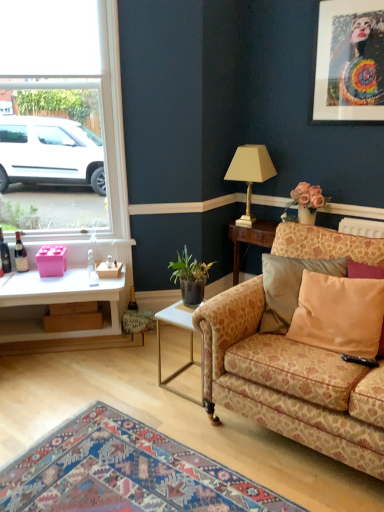
I want to click on free space underneath white metal side table at lower center (from a real-world perspective), so [x=185, y=385].